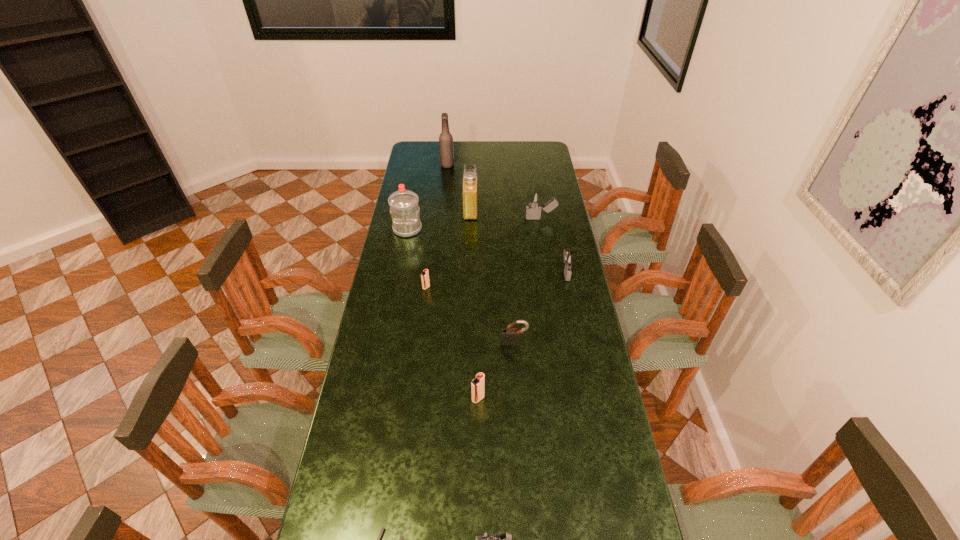
Image resolution: width=960 pixels, height=540 pixels. I want to click on the tallest object, so click(x=445, y=139).

Where is `the farthest object`? the farthest object is located at coordinates (445, 139).

Where is `perfume`? The height and width of the screenshot is (540, 960). perfume is located at coordinates (470, 188).

The image size is (960, 540). Find the location of `white water bottle`. white water bottle is located at coordinates click(x=404, y=208).

Find the location of a particular element. The image size is (960, 540). the biggest gray igniter is located at coordinates click(534, 198).

This screenshot has height=540, width=960. Find the location of `the tallest igniter`. the tallest igniter is located at coordinates (534, 198).

Locate an element on the screen. the second biggest gray igniter is located at coordinates (569, 260).

Locate an element on the screen. Image resolution: width=960 pixels, height=540 pixels. the fourth nearest igniter is located at coordinates (569, 260).

Image resolution: width=960 pixels, height=540 pixels. In order to click on the fourth farthest igniter in this screenshot , I will do `click(478, 384)`.

Find the location of a particular element. the nearer red igniter is located at coordinates (478, 384).